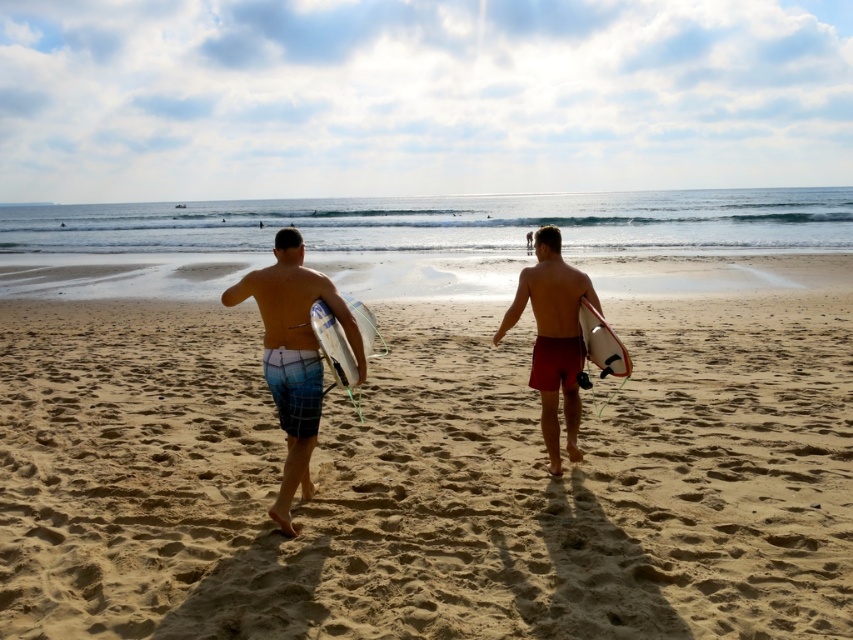
You are standing at the point marked by coordinates (294, 355) on the beach. Looking around, you see two people walking towards the ocean with surfboards. Which person is wearing blue plaid shorts?

The person on the left is wearing blue plaid shorts at center, so the person on the left is the one wearing blue plaid shorts.

In the scene shown: You are a photographer trying to capture the two surfers walking towards the ocean. You notice the blue plaid shorts at center and the matte red shorts at center. Which surfer should you focus on if you want to capture someone who appears taller in the photo?

The blue plaid shorts at center is taller than the matte red shorts at center, so focusing on the blue plaid shorts at center will capture the taller surfer.